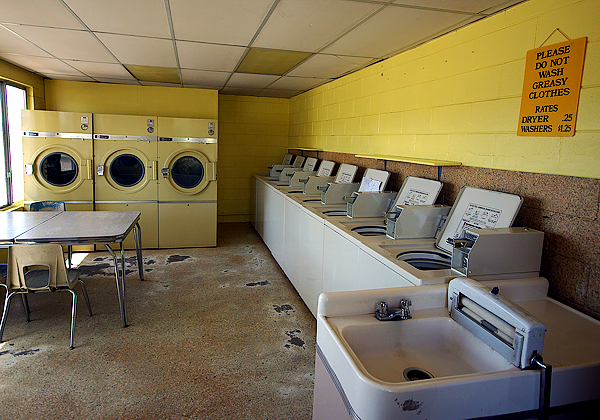
The image size is (600, 420). Find the location of `hard floor`. hard floor is located at coordinates (261, 282).